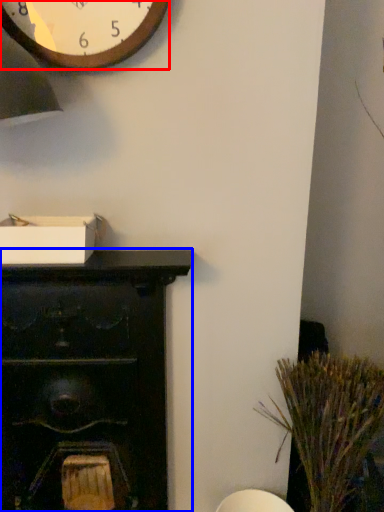
Question: Which of the following is the closest to the observer, wall clock (highlighted by a red box) or furniture (highlighted by a blue box)?

Choices:
 (A) wall clock
 (B) furniture

Answer: (A)